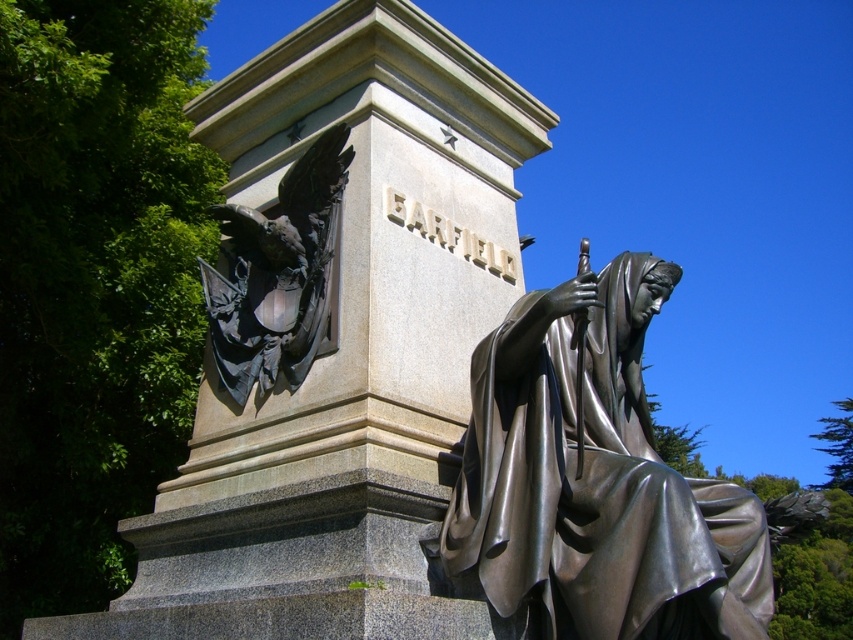
Is bronze statue at center above polished bronze eagle at left?

No.

How far apart are bronze statue at center and polished bronze eagle at left?

8.32 meters

Which is in front, point (509, 566) or point (206, 268)?

Point (509, 566) is in front.

This screenshot has height=640, width=853. In order to click on bronze statue at center in this screenshot , I will do point(596,481).